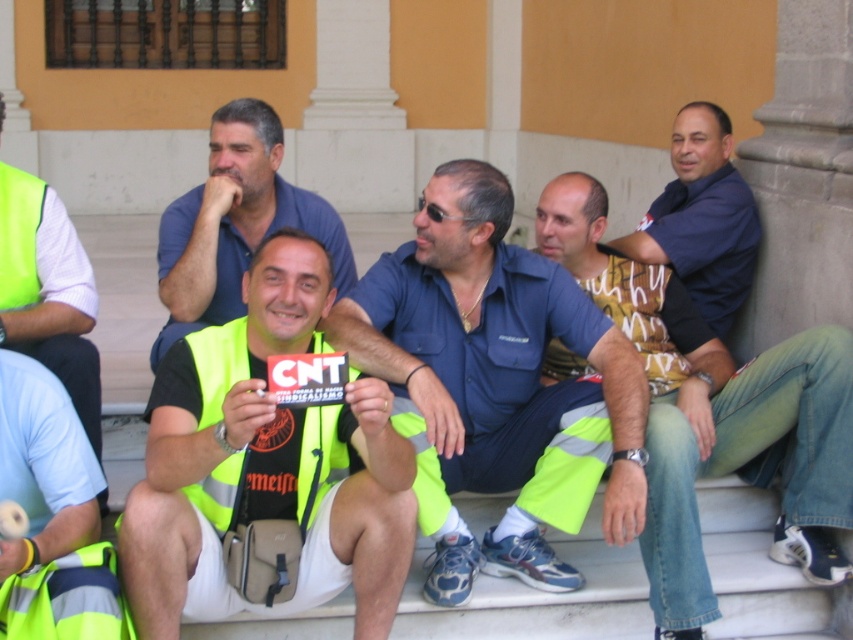
Question: Which of the following is the farthest from the observer?

Choices:
 (A) (683, 173)
 (B) (19, 280)
 (C) (802, 416)
 (D) (210, 198)

Answer: (A)

Question: Which point appears farthest from the camera in this image?

Choices:
 (A) (25, 259)
 (B) (676, 154)
 (C) (177, 266)

Answer: (B)

Question: Which point is closer to the camera?

Choices:
 (A) high visibility yellow vest at center
 (B) yellow high-visibility vest at center
 (C) blue fabric shirt at center
 (D) blue shirt at upper right

Answer: (A)

Question: Is matte blue shirt at center below yellow high-visibility vest at center?

Choices:
 (A) yes
 (B) no

Answer: (B)

Question: From the image, what is the correct spatial relationship of denim jeans at center in relation to blue shirt at upper right?

Choices:
 (A) right
 (B) left

Answer: (B)

Question: Where is high visibility yellow vest at center located in relation to high visibility vest at left in the image?

Choices:
 (A) above
 (B) below

Answer: (B)